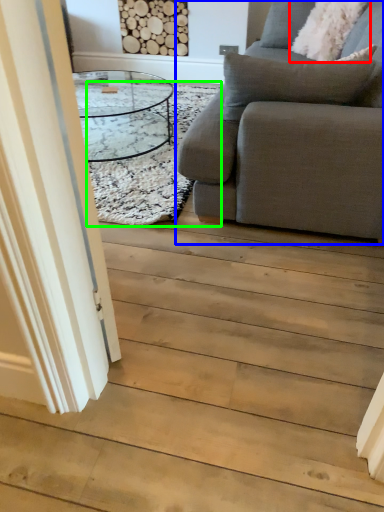
Question: Which object is the closest to the pillow (highlighted by a red box)? Choose among these: studio couch (highlighted by a blue box) or mat (highlighted by a green box).

Choices:
 (A) studio couch
 (B) mat

Answer: (B)